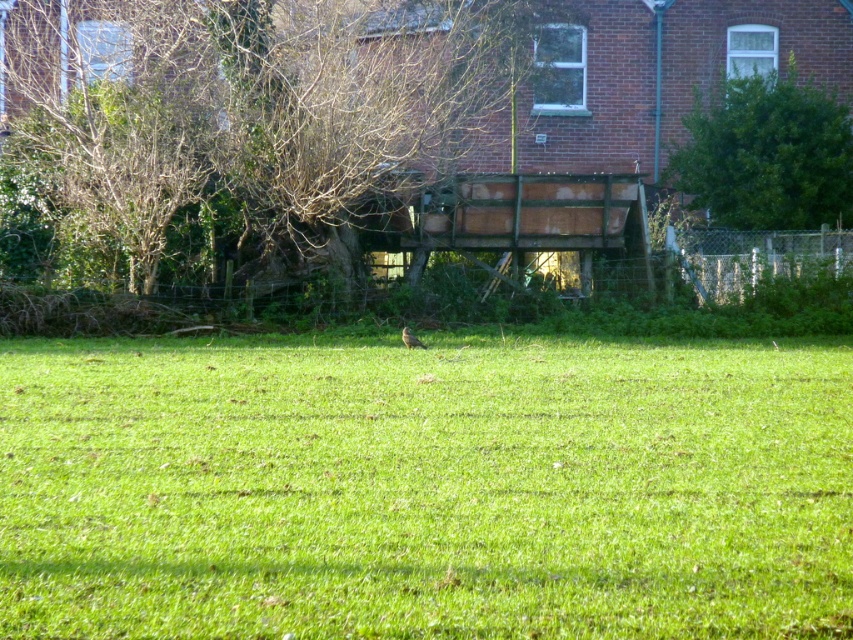
Between green grass at center and green leafy tree at upper right, which one is positioned lower?

green grass at center is lower down.

Is green grass at center shorter than green leafy tree at upper right?

No.

What do you see at coordinates (425, 486) in the screenshot? Image resolution: width=853 pixels, height=640 pixels. I see `green grass at center` at bounding box center [425, 486].

Image resolution: width=853 pixels, height=640 pixels. I want to click on green grass at center, so click(x=425, y=486).

Identify the location of brown wood tree at upper center. The height and width of the screenshot is (640, 853). (231, 129).

Measure the distance from brown wood tree at upper center to brown feathered bird at center.

brown wood tree at upper center and brown feathered bird at center are 7.74 meters apart from each other.

Find the location of `brown wood tree at upper center`. brown wood tree at upper center is located at coordinates (231, 129).

Can you confirm if green grass at center is taller than brown feathered bird at center?

Correct, green grass at center is much taller as brown feathered bird at center.

Does green grass at center have a lesser height compared to brown feathered bird at center?

Incorrect, green grass at center's height does not fall short of brown feathered bird at center's.

Locate an element on the screen. green grass at center is located at coordinates (425, 486).

Image resolution: width=853 pixels, height=640 pixels. In order to click on green grass at center in this screenshot , I will do `click(425, 486)`.